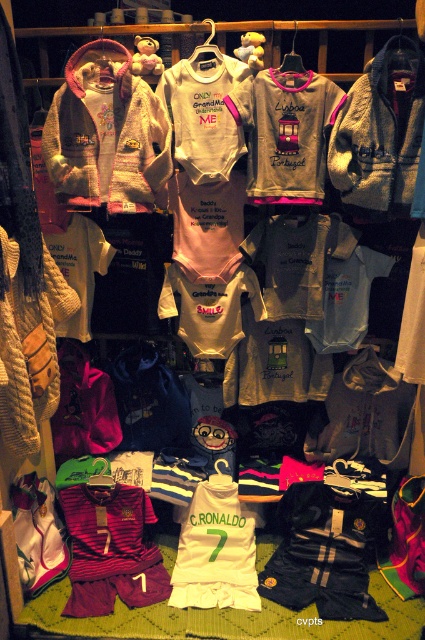
Does bright maroon jersey at center come in front of white jersey at center?

Yes, it is.

Is point (156, 572) positioned in front of point (255, 580)?

No, (156, 572) is further to viewer.

Image resolution: width=425 pixels, height=640 pixels. What are the coordinates of `bright maroon jersey at center` in the screenshot? It's located at (110, 548).

I want to click on bright maroon jersey at center, so click(110, 548).